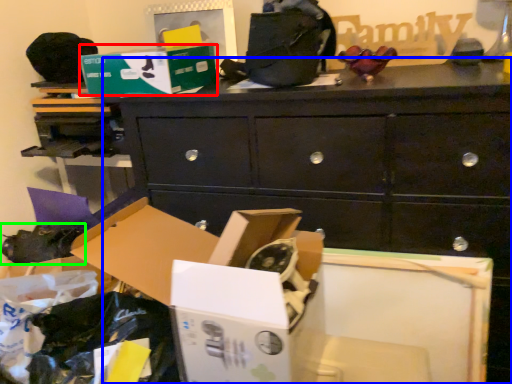
Question: Based on their relative distances, which object is nearer to storage box (highlighted by a red box)? Choose from chest of drawers (highlighted by a blue box) and shoe (highlighted by a green box).

Choices:
 (A) chest of drawers
 (B) shoe

Answer: (A)